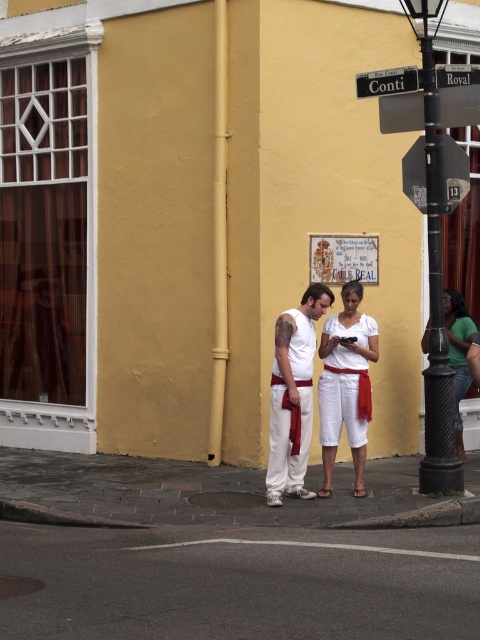
Consider the image. You are standing at the street corner and want to reach the point marked as point (411, 156). If your walking speed is 3 feet per second, how many seconds will it take you to reach that point?

The distance between you and point (411, 156) is 32.12 feet. At a speed of 3 feet per second, it would take approximately 10.71 seconds to reach the point.